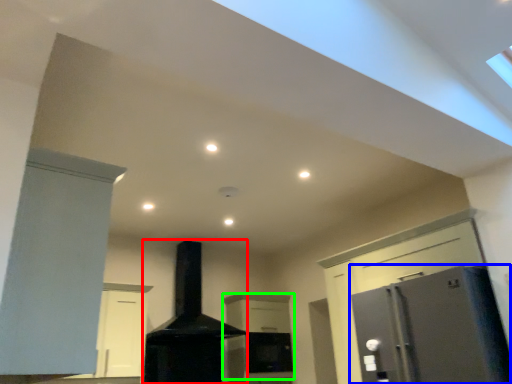
Question: Which object is positioned closest to fireplace (highlighted by a red box)? Select from refrigerator (highlighted by a blue box) and cabinetry (highlighted by a green box).

Choices:
 (A) refrigerator
 (B) cabinetry

Answer: (B)